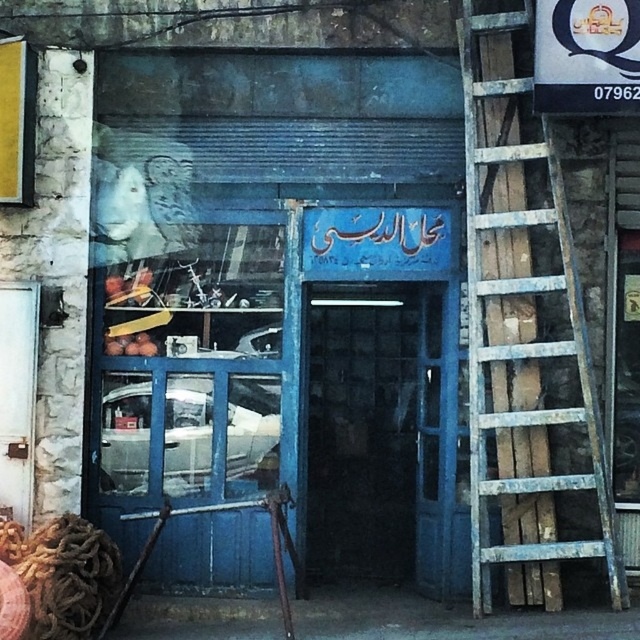
Question: Does rusty wood ladder at right appear over blue glass door at center?

Choices:
 (A) no
 (B) yes

Answer: (B)

Question: Is rusty wood ladder at right to the left of blue glass door at center from the viewer's perspective?

Choices:
 (A) no
 (B) yes

Answer: (A)

Question: Which point is farther from the camera taking this photo?

Choices:
 (A) click(x=529, y=348)
 (B) click(x=384, y=502)

Answer: (B)

Question: Is rusty wood ladder at right above blue glass door at center?

Choices:
 (A) no
 (B) yes

Answer: (B)

Question: Which point is closer to the camera?

Choices:
 (A) (358, 477)
 (B) (486, 179)

Answer: (B)